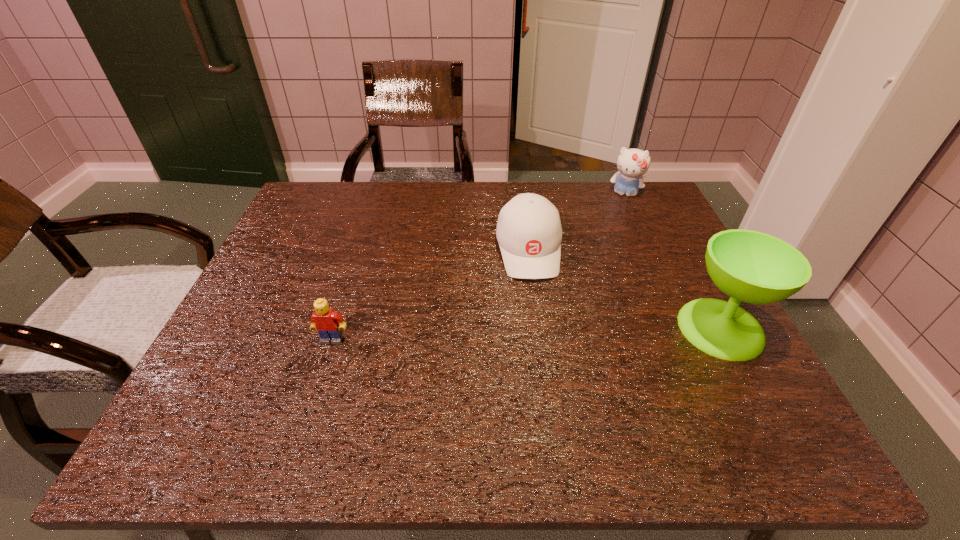
The height and width of the screenshot is (540, 960). What are the coordinates of `the leftmost object` in the screenshot? It's located at (325, 321).

Where is `wineglass`? This screenshot has width=960, height=540. wineglass is located at coordinates 753,267.

You are a GUI agent. You are given a task and a screenshot of the screen. Output one action in this format:
    pyautogui.click(x=<x>, y=<y>)
    Task: Click on the second farthest object
    
    Given the screenshot: What is the action you would take?
    pyautogui.click(x=529, y=233)

You are a GUI agent. You are given a task and a screenshot of the screen. Output one action in this format:
    pyautogui.click(x=<x>, y=<y>)
    Task: Click on the baseball cap
    
    Given the screenshot: What is the action you would take?
    (529, 233)

The image size is (960, 540). Find the location of `kitten`. kitten is located at coordinates (632, 163).

Find the location of a particular element. vacant space situated 0.140m on the front-facing side of the Lego is located at coordinates (312, 402).

Where is `free point located 0.050m on the front of the wineglass`? free point located 0.050m on the front of the wineglass is located at coordinates click(x=749, y=382).

Identify the location of vacant position located 0.060m on the front-facing side of the second object from left to right. (537, 300).

Locate an element on the screen. The height and width of the screenshot is (540, 960). free spot located on the front-facing side of the second object from left to right is located at coordinates (546, 358).

Locate an element on the screen. This screenshot has width=960, height=540. vacant area situated on the front-facing side of the second object from left to right is located at coordinates (554, 400).